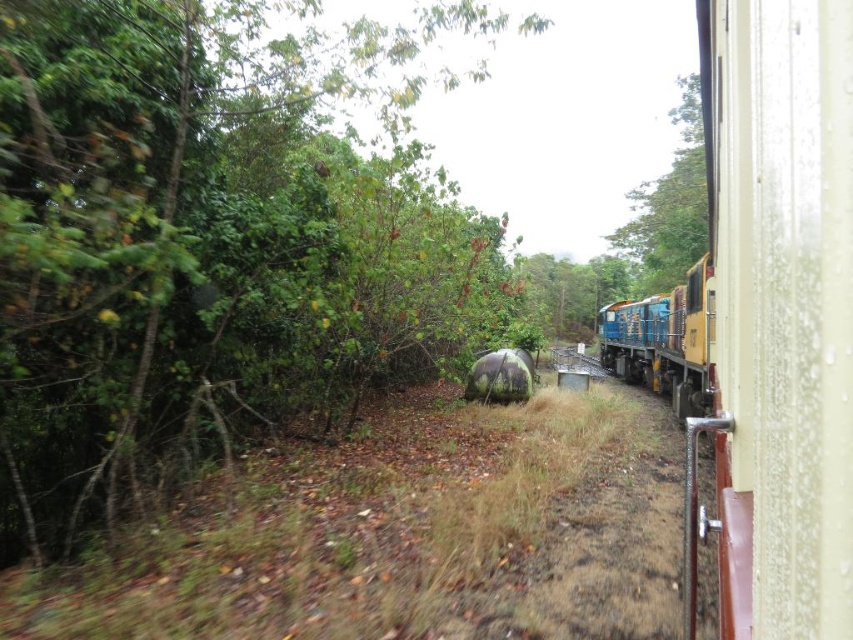
Question: Does brown dirt track at center appear under green leafy tree at upper center?

Choices:
 (A) no
 (B) yes

Answer: (B)

Question: Which of the following is the farthest from the observer?

Choices:
 (A) green leafy tree at upper center
 (B) green leafy tree at left
 (C) blue metallic train at right
 (D) brown dirt track at center

Answer: (A)

Question: Is brown dirt track at center to the left of blue metallic train at right from the viewer's perspective?

Choices:
 (A) yes
 (B) no

Answer: (A)

Question: Which of these objects is positioned farthest from the brown dirt track at center?

Choices:
 (A) green leafy tree at upper center
 (B) green leafy tree at left
 (C) blue metallic train at right

Answer: (A)

Question: Considering the real-world distances, which object is farthest from the green leafy tree at upper center?

Choices:
 (A) green leafy tree at left
 (B) blue metallic train at right
 (C) brown dirt track at center

Answer: (C)

Question: Where is green leafy tree at left located in relation to brown dirt track at center in the image?

Choices:
 (A) above
 (B) below

Answer: (A)